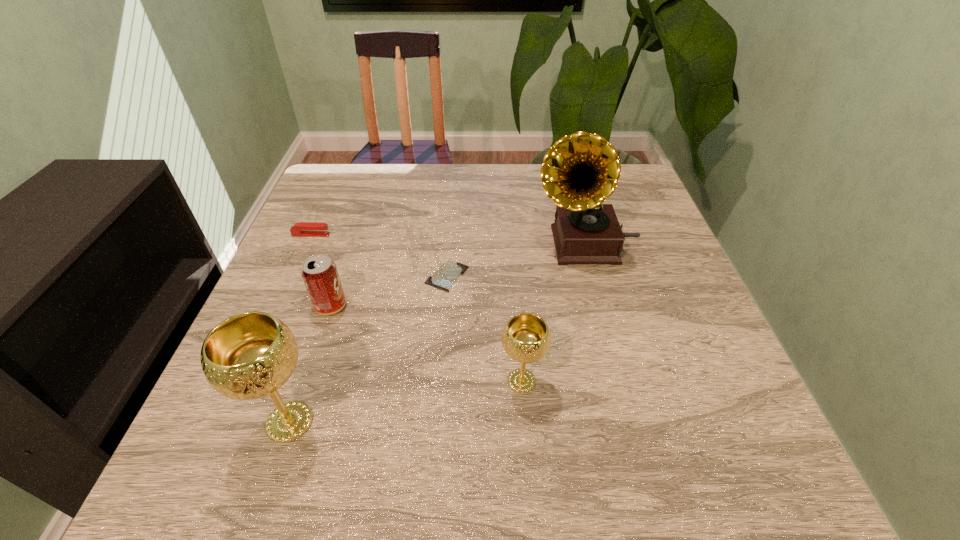
Find the location of a particular element. This screenshot has height=540, width=960. soda can located at the left edge is located at coordinates (319, 273).

Where is `stapler that is positioned at the left edge`? The image size is (960, 540). stapler that is positioned at the left edge is located at coordinates [x=302, y=229].

Find the location of `object positioned at the right edge`. object positioned at the right edge is located at coordinates (580, 171).

The width and height of the screenshot is (960, 540). Identify the location of object located in the near left corner section of the desktop. (250, 355).

You are a GUI agent. You are given a task and a screenshot of the screen. Output one action in this format:
    pyautogui.click(x=<x>, y=<y>)
    Task: Click on the vacant space at the far edge of the desktop
    
    Given the screenshot: What is the action you would take?
    pyautogui.click(x=509, y=187)

The width and height of the screenshot is (960, 540). In the image, there is a desktop. In order to click on vacant space at the near edge in this screenshot , I will do `click(417, 402)`.

At what (x,y) coordinates should I click in order to perform the action: click on vacant space at the left edge of the desktop. Please return your answer as a coordinate pair (x, y). The image size is (960, 540). Looking at the image, I should click on (288, 281).

I want to click on vacant space at the right edge, so [x=684, y=342].

Where is `vacant space at the far right corner`? vacant space at the far right corner is located at coordinates (636, 199).

This screenshot has height=540, width=960. In order to click on free point between the shortest object and the fifth tallest object in this screenshot , I will do `click(379, 255)`.